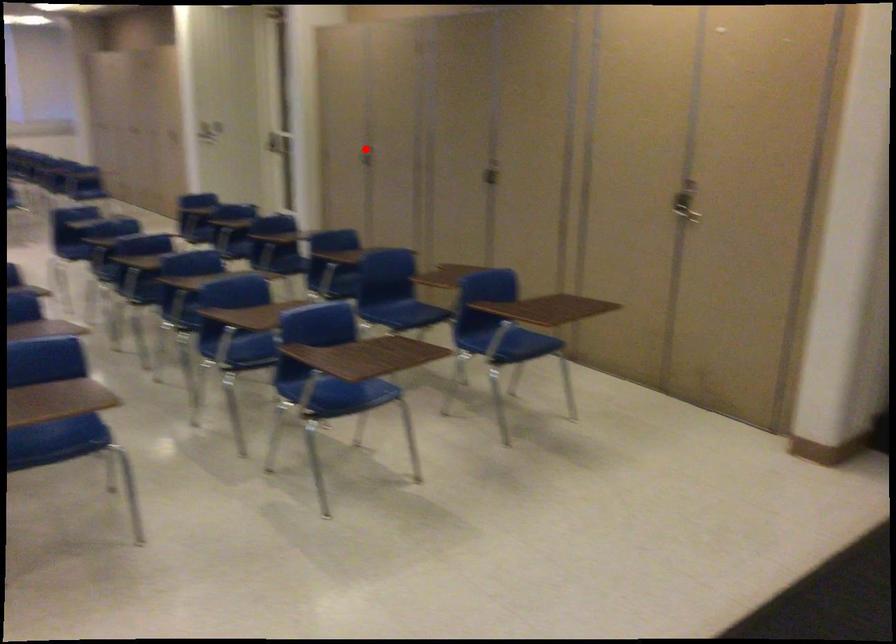
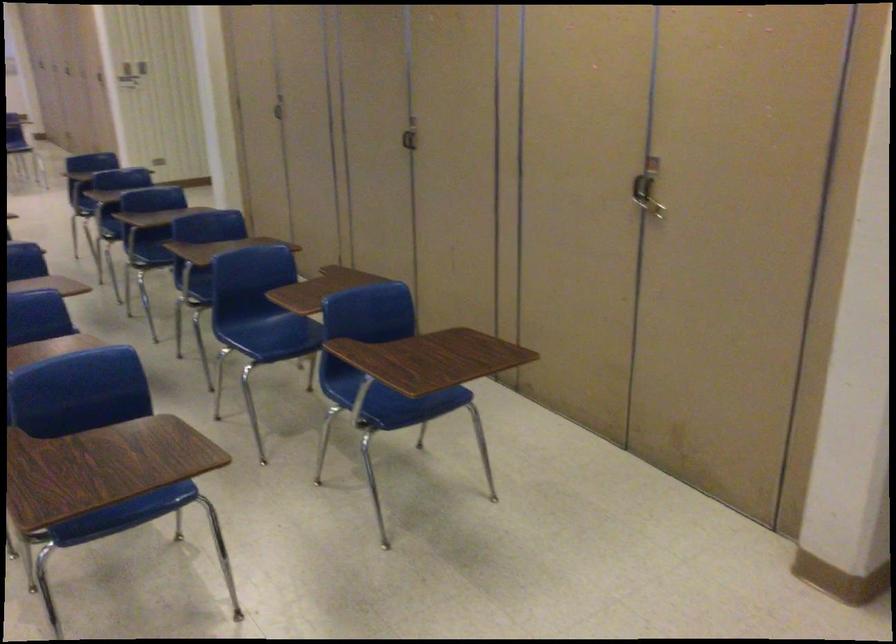
Question: I am providing you with two images of the same scene from different viewpoints. A red point is shown in image1. For the corresponding object point in image2, is it positioned nearer or farther from the camera?

Choices:
 (A) Nearer
 (B) Farther

Answer: (A)